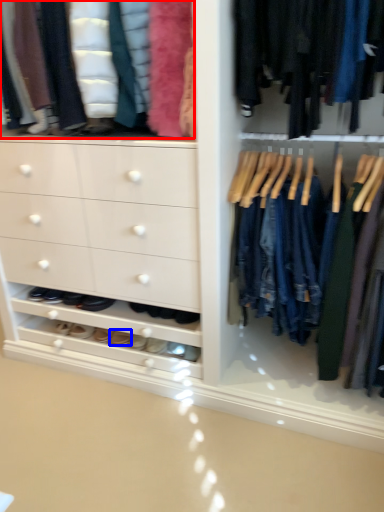
Question: Which of the following is the closest to the observer, clothing (highlighted by a red box) or footwear (highlighted by a blue box)?

Choices:
 (A) clothing
 (B) footwear

Answer: (A)